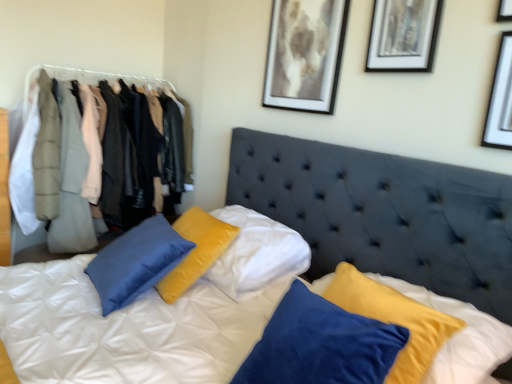
You are a GUI agent. You are given a task and a screenshot of the screen. Output one action in this format:
    pyautogui.click(x=<x>, y=<y>)
    Task: Click on the velvet jackets at left
    
    Given the screenshot: What is the action you would take?
    pyautogui.click(x=117, y=92)

Image resolution: width=512 pixels, height=384 pixels. What do you see at coordinates (117, 92) in the screenshot?
I see `velvet jackets at left` at bounding box center [117, 92].

How much space does matte gray coat at left, placed as the second clothing when sorted from front to back, occupy horizontally?

25.12 inches.

At what (x,y) coordinates should I click in order to perform the action: click on velvet jackets at left. Please return your answer as a coordinate pair (x, y). Looking at the image, I should click on (117, 92).

Relative to light beige fabric coat at left, the 2th clothing when ordered from back to front, is matte black picture frame at upper center, placed as the first picture frame when sorted from back to front, in front or behind?

matte black picture frame at upper center, placed as the first picture frame when sorted from back to front, is in front of light beige fabric coat at left, the 2th clothing when ordered from back to front.

This screenshot has height=384, width=512. Find the location of `the 2nd clothing to the left of the matte black picture frame at upper center, the third picture frame positioned from the front, starting your count from the anchor`. the 2nd clothing to the left of the matte black picture frame at upper center, the third picture frame positioned from the front, starting your count from the anchor is located at coordinates (47, 152).

From a real-world perspective, is matte black picture frame at upper center, the third picture frame positioned from the front, under light beige fabric coat at left, marked as the 1th clothing in a front-to-back arrangement?

Incorrect, from a real-world perspective, matte black picture frame at upper center, the third picture frame positioned from the front, is higher than light beige fabric coat at left, marked as the 1th clothing in a front-to-back arrangement.

Could you measure the distance between matte black picture frame at upper center, the third picture frame positioned from the front, and light beige fabric coat at left, the 2th clothing when ordered from back to front?

matte black picture frame at upper center, the third picture frame positioned from the front, is 1.46 meters away from light beige fabric coat at left, the 2th clothing when ordered from back to front.

The height and width of the screenshot is (384, 512). What are the coordinates of `picture frame that is the 1st object located in front of the light beige fabric coat at left, the 2th clothing when ordered from back to front` in the screenshot? It's located at (305, 55).

From a real-world perspective, which is physically below, light beige fabric coat at left, the 2th clothing when ordered from back to front, or matte black picture frame at upper center, placed as the first picture frame when sorted from back to front?

light beige fabric coat at left, the 2th clothing when ordered from back to front.

Does point (51, 113) come behind point (311, 74)?

Yes, it is behind point (311, 74).

Based on the photo, does light beige fabric coat at left, the 2th clothing when ordered from back to front, have a smaller size compared to matte black picture frame at upper center, placed as the first picture frame when sorted from back to front?

Actually, light beige fabric coat at left, the 2th clothing when ordered from back to front, might be larger than matte black picture frame at upper center, placed as the first picture frame when sorted from back to front.

Can you see matte black picture frame at upper right, the 2th picture frame when ordered from left to right, touching matte black picture frame at upper center, placed as the first picture frame when sorted from back to front?

There is a gap between matte black picture frame at upper right, the 2th picture frame when ordered from left to right, and matte black picture frame at upper center, placed as the first picture frame when sorted from back to front.

Considering the relative sizes of matte black picture frame at upper right, the 2th picture frame when ordered from left to right, and matte black picture frame at upper center, the third picture frame positioned from the front, in the image provided, is matte black picture frame at upper right, the 2th picture frame when ordered from left to right, shorter than matte black picture frame at upper center, the third picture frame positioned from the front,?

Indeed, matte black picture frame at upper right, the 2th picture frame when ordered from left to right, has a lesser height compared to matte black picture frame at upper center, the third picture frame positioned from the front.

How different are the orientations of matte black picture frame at upper right, arranged as the 2th picture frame when viewed from the front, and matte black picture frame at upper center, the third picture frame positioned from the front, in degrees?

0.00236 degrees.

Who is more distant, matte black picture frame at upper right, the 2th picture frame when ordered from left to right, or velvet jackets at left?

velvet jackets at left is further from the camera.

Between point (374, 19) and point (71, 76), which one is positioned behind?

Point (71, 76)

Identify the location of closet below the matte gray coat at left, placed as the second clothing when sorted from front to back (from the image's perspective). (117, 92).

Considering the positions of point (55, 77) and point (79, 131), is point (55, 77) closer or farther from the camera than point (79, 131)?

Clearly, point (55, 77) is more distant from the camera than point (79, 131).

Between velvet jackets at left and matte gray coat at left, which ranks as the first clothing in back-to-front order, which one has smaller width?

Thinner between the two is velvet jackets at left.

Is matte gray coat at left, which ranks as the first clothing in back-to-front order, located within velvet jackets at left?

Absolutely, matte gray coat at left, which ranks as the first clothing in back-to-front order, is inside velvet jackets at left.

From the matte black picture frame at upper center, the third picture frame positioned from the front, count 2nd picture frame to the right and point to it. Please provide its 2D coordinates.

[(500, 100)]

Which is nearer, (x=309, y=107) or (x=500, y=84)?

Clearly, point (x=309, y=107) is more distant from the camera than point (x=500, y=84).

Between matte black picture frame at upper center, marked as the 3th picture frame in a right-to-left arrangement, and white matte picture frame at upper right, which is counted as the 3th picture frame, starting from the left, which one has larger size?

matte black picture frame at upper center, marked as the 3th picture frame in a right-to-left arrangement, is bigger.

Is the position of matte black picture frame at upper center, the third picture frame positioned from the front, less distant than that of white matte picture frame at upper right, the first picture frame viewed from the right?

No, matte black picture frame at upper center, the third picture frame positioned from the front, is further to the viewer.

Considering the sizes of velvet jackets at left and suede-like dark blue headboard at center in the image, is velvet jackets at left taller or shorter than suede-like dark blue headboard at center?

In the image, velvet jackets at left appears to be taller than suede-like dark blue headboard at center.

Is velvet jackets at left located outside suede-like dark blue headboard at center?

Yes, velvet jackets at left is located beyond the bounds of suede-like dark blue headboard at center.

Is velvet jackets at left facing away from suede-like dark blue headboard at center?

velvet jackets at left does not have its back to suede-like dark blue headboard at center.

At what (x,y) coordinates should I click in order to perform the action: click on the 1st clothing behind the matte black picture frame at upper center, marked as the first picture frame in a left-to-right arrangement. Please return your answer as a coordinate pair (x, y). Looking at the image, I should click on (47, 152).

Image resolution: width=512 pixels, height=384 pixels. There is a matte black picture frame at upper center, placed as the first picture frame when sorted from back to front. What are the coordinates of `the 1st clothing below it (from the image's perspective)` in the screenshot? It's located at (47, 152).

Which object lies nearer to the anchor point light beige fabric coat at left, marked as the 1th clothing in a front-to-back arrangement, white matte picture frame at upper right, the first picture frame viewed from the right, or matte gray coat at left, which ranks as the first clothing in back-to-front order?

matte gray coat at left, which ranks as the first clothing in back-to-front order.

From the image, which object appears to be farther from matte black picture frame at upper center, marked as the 3th picture frame in a right-to-left arrangement, matte black picture frame at upper right, arranged as the 2th picture frame when viewed from the front, or light beige fabric coat at left, marked as the 1th clothing in a front-to-back arrangement?

light beige fabric coat at left, marked as the 1th clothing in a front-to-back arrangement, lies further to matte black picture frame at upper center, marked as the 3th picture frame in a right-to-left arrangement, than the other object.

Based on their spatial positions, is suede-like dark blue headboard at center or light beige fabric coat at left, marked as the 1th clothing in a front-to-back arrangement, closer to matte gray coat at left, placed as the second clothing when sorted from front to back?

light beige fabric coat at left, marked as the 1th clothing in a front-to-back arrangement, is positioned closer to the anchor matte gray coat at left, placed as the second clothing when sorted from front to back.

Based on their spatial positions, is matte black picture frame at upper right, the 2th picture frame positioned from the back, or light beige fabric coat at left, marked as the 1th clothing in a front-to-back arrangement, further from suede-like dark blue headboard at center?

The object further to suede-like dark blue headboard at center is light beige fabric coat at left, marked as the 1th clothing in a front-to-back arrangement.

Based on their spatial positions, is white matte picture frame at upper right, marked as the third picture frame in a back-to-front arrangement, or matte gray coat at left, which ranks as the first clothing in back-to-front order, closer to suede-like dark blue headboard at center?

white matte picture frame at upper right, marked as the third picture frame in a back-to-front arrangement.

When comparing their distances from white matte picture frame at upper right, marked as the third picture frame in a back-to-front arrangement, does matte black picture frame at upper right, which appears as the 2th picture frame when viewed from the right, or light beige fabric coat at left, the 2th clothing when ordered from back to front, seem further?

Among the two, light beige fabric coat at left, the 2th clothing when ordered from back to front, is located further to white matte picture frame at upper right, marked as the third picture frame in a back-to-front arrangement.

From the image, which object appears to be nearer to matte black picture frame at upper right, which appears as the 2th picture frame when viewed from the right, matte gray coat at left, placed as the second clothing when sorted from front to back, or white matte picture frame at upper right, the first picture frame viewed from the right?

The object closer to matte black picture frame at upper right, which appears as the 2th picture frame when viewed from the right, is white matte picture frame at upper right, the first picture frame viewed from the right.

Estimate the real-world distances between objects in this image. Which object is closer to white matte picture frame at upper right, which is the 1th picture frame in front-to-back order, light beige fabric coat at left, the 2th clothing when ordered from back to front, or matte black picture frame at upper center, marked as the first picture frame in a left-to-right arrangement?

matte black picture frame at upper center, marked as the first picture frame in a left-to-right arrangement, is positioned closer to the anchor white matte picture frame at upper right, which is the 1th picture frame in front-to-back order.

This screenshot has width=512, height=384. Find the location of `headboard between light beige fabric coat at left, marked as the 1th clothing in a front-to-back arrangement, and white matte picture frame at upper right, which is counted as the 3th picture frame, starting from the left, from left to right`. headboard between light beige fabric coat at left, marked as the 1th clothing in a front-to-back arrangement, and white matte picture frame at upper right, which is counted as the 3th picture frame, starting from the left, from left to right is located at coordinates (384, 214).

Identify the location of headboard between velvet jackets at left and white matte picture frame at upper right, marked as the third picture frame in a back-to-front arrangement. Image resolution: width=512 pixels, height=384 pixels. (384, 214).

Locate an element on the screen. This screenshot has width=512, height=384. clothing between light beige fabric coat at left, marked as the 1th clothing in a front-to-back arrangement, and suede-like dark blue headboard at center from left to right is located at coordinates (71, 182).

This screenshot has height=384, width=512. I want to click on headboard located between velvet jackets at left and matte black picture frame at upper right, which appears as the 2th picture frame when viewed from the right, in the left-right direction, so click(x=384, y=214).